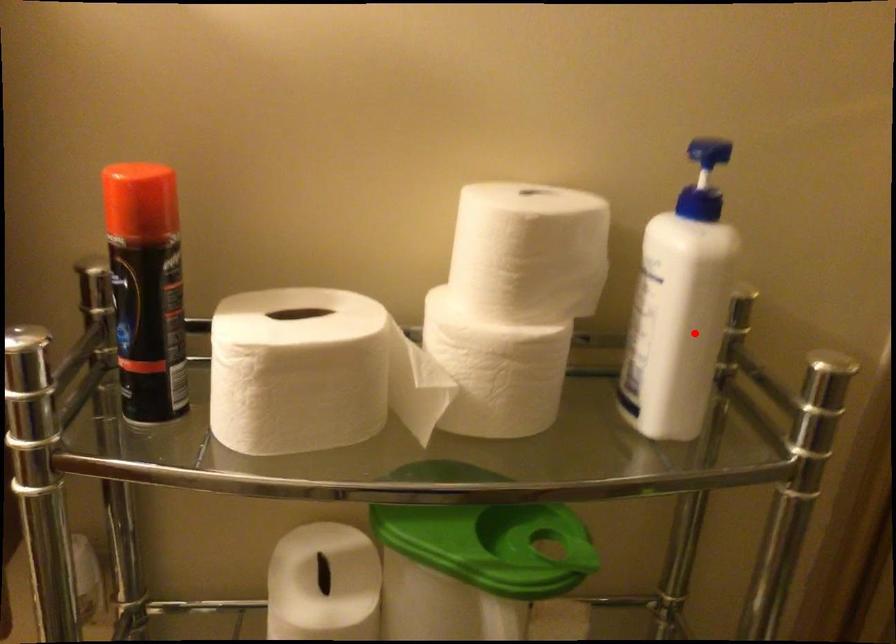
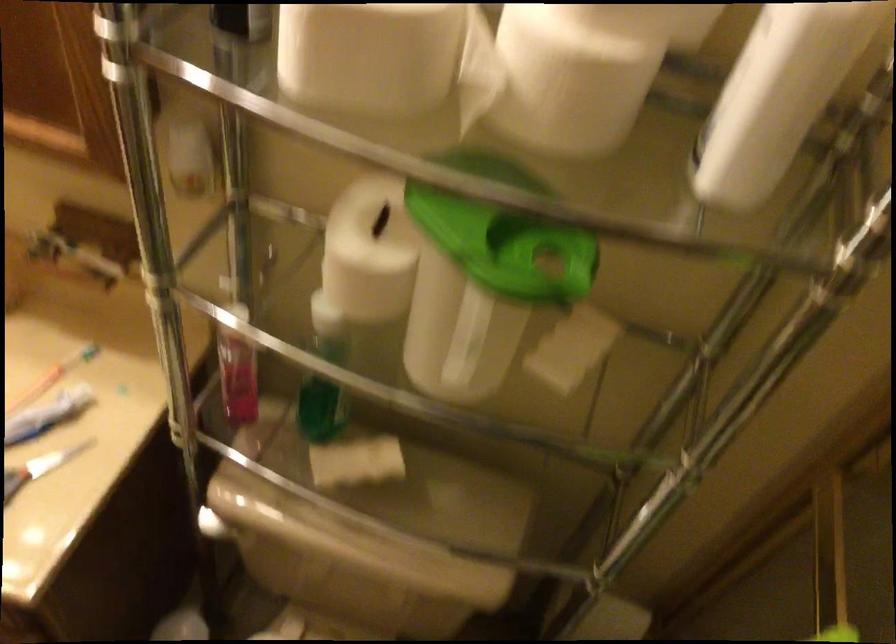
In the second image, find the point that corresponds to the highlighted location in the first image.

(778, 96)